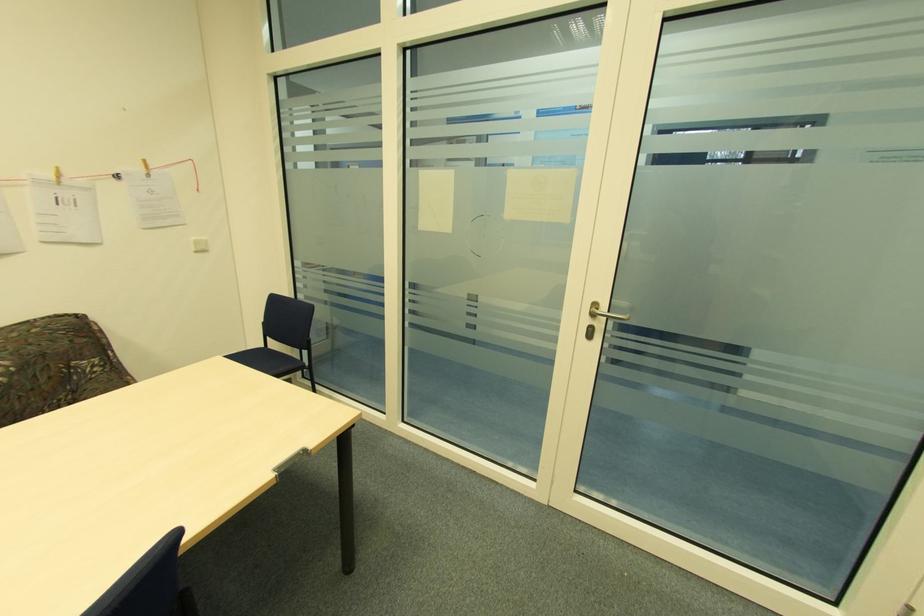
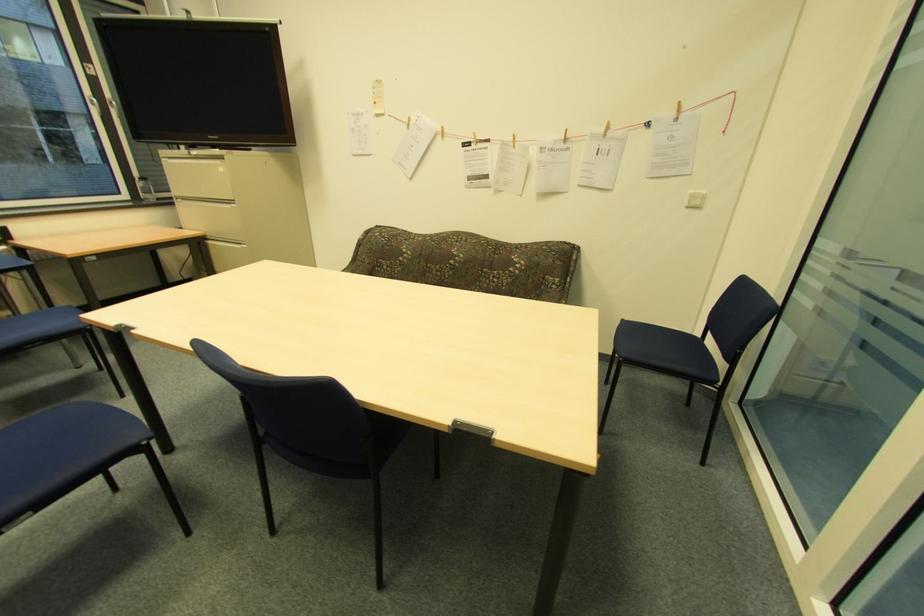
The images are taken continuously from a first-person perspective. In which direction is your viewpoint rotating?

The rotation direction of the camera is left-down.